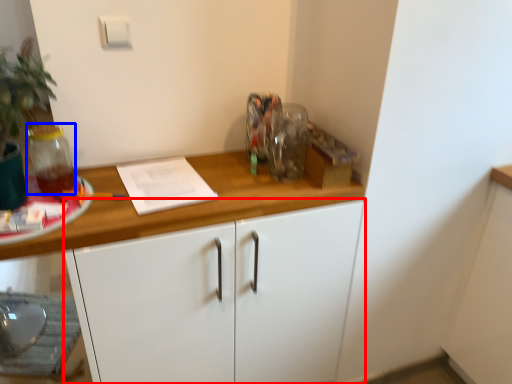
Question: Which of the following is the farthest to the observer, cabinetry (highlighted by a red box) or glass jar (highlighted by a blue box)?

Choices:
 (A) cabinetry
 (B) glass jar

Answer: (B)